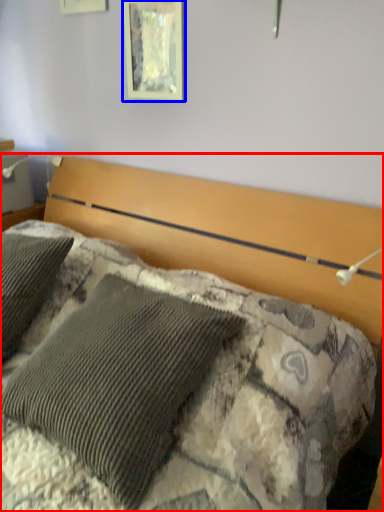
Question: Which object is further to the camera taking this photo, bed (highlighted by a red box) or picture frame (highlighted by a blue box)?

Choices:
 (A) bed
 (B) picture frame

Answer: (B)